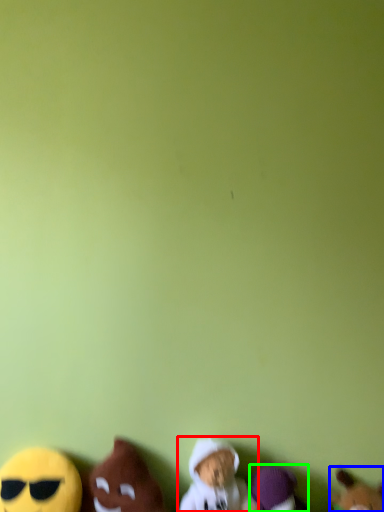
Question: Based on their relative distances, which object is nearer to toy (highlighted by a red box)? Choose from toy (highlighted by a blue box) and toy (highlighted by a green box).

Choices:
 (A) toy
 (B) toy

Answer: (B)